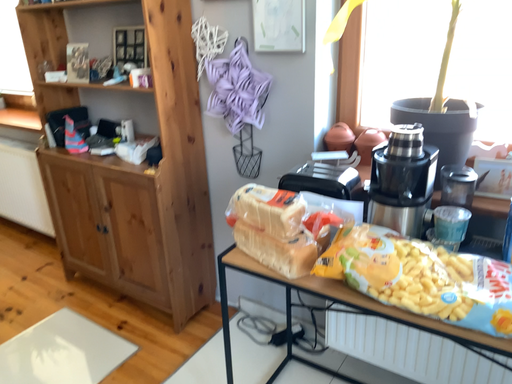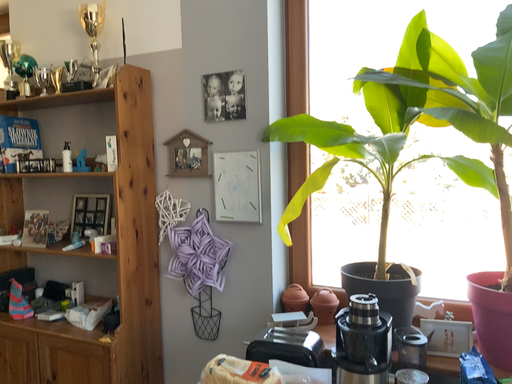
Question: Which way did the camera rotate in the video?

Choices:
 (A) rotated right
 (B) rotated left

Answer: (A)